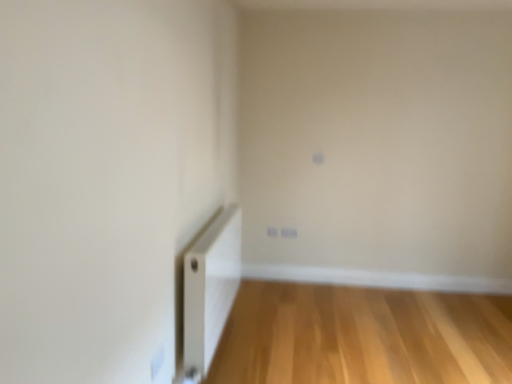
Question: Is light wood floor at lower right aimed at white plastic radiator at lower left?

Choices:
 (A) no
 (B) yes

Answer: (A)

Question: Is white plastic radiator at lower left completely or partially inside light wood floor at lower right?

Choices:
 (A) yes
 (B) no

Answer: (B)

Question: Is light wood floor at lower right positioned before white plastic radiator at lower left?

Choices:
 (A) no
 (B) yes

Answer: (A)

Question: Can you confirm if light wood floor at lower right is positioned to the right of white plastic radiator at lower left?

Choices:
 (A) no
 (B) yes

Answer: (B)

Question: Is light wood floor at lower right placed right next to white plastic radiator at lower left?

Choices:
 (A) yes
 (B) no

Answer: (B)

Question: From the image's perspective, is light wood floor at lower right located beneath white plastic radiator at lower left?

Choices:
 (A) yes
 (B) no

Answer: (A)

Question: Considering the relative sizes of white plastic radiator at lower left and light wood floor at lower right in the image provided, is white plastic radiator at lower left shorter than light wood floor at lower right?

Choices:
 (A) no
 (B) yes

Answer: (A)

Question: Is white plastic radiator at lower left completely or partially outside of light wood floor at lower right?

Choices:
 (A) no
 (B) yes

Answer: (B)

Question: Does white plastic radiator at lower left have a greater height compared to light wood floor at lower right?

Choices:
 (A) yes
 (B) no

Answer: (A)

Question: Can you confirm if white plastic radiator at lower left is bigger than light wood floor at lower right?

Choices:
 (A) no
 (B) yes

Answer: (B)

Question: Is white plastic radiator at lower left turned away from light wood floor at lower right?

Choices:
 (A) yes
 (B) no

Answer: (B)

Question: From the image's perspective, is white plastic radiator at lower left above light wood floor at lower right?

Choices:
 (A) yes
 (B) no

Answer: (A)

Question: Visually, is white plastic radiator at lower left positioned to the left or to the right of light wood floor at lower right?

Choices:
 (A) right
 (B) left

Answer: (B)